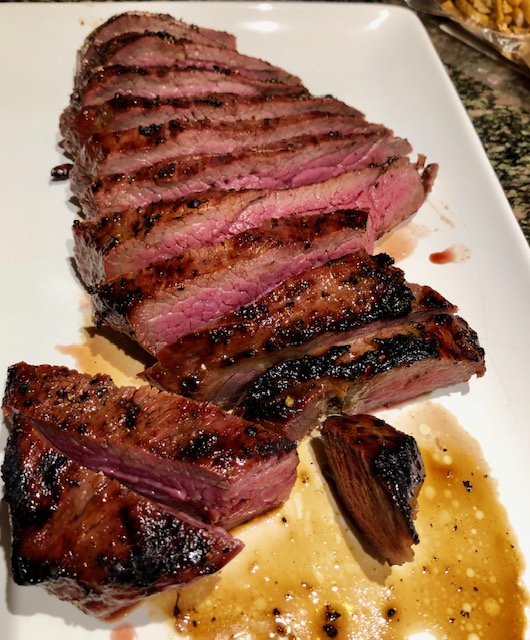
At what (x,y) coordinates should I click in order to perform the action: click on plate. Please return your answer as a coordinate pair (x, y). The image size is (530, 640). Looking at the image, I should click on (476, 276).